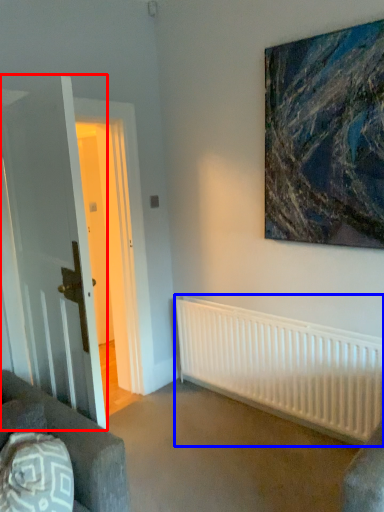
Question: Which object appears farthest to the camera in this image, glass door (highlighted by a red box) or radiator (highlighted by a blue box)?

Choices:
 (A) glass door
 (B) radiator

Answer: (B)